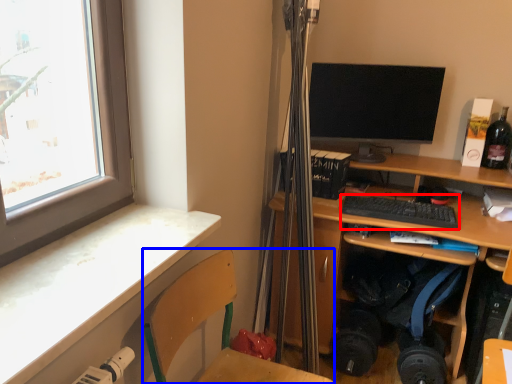
Question: Which object appears closest to the camera in this image, computer keyboard (highlighted by a red box) or folding chair (highlighted by a blue box)?

Choices:
 (A) computer keyboard
 (B) folding chair

Answer: (B)